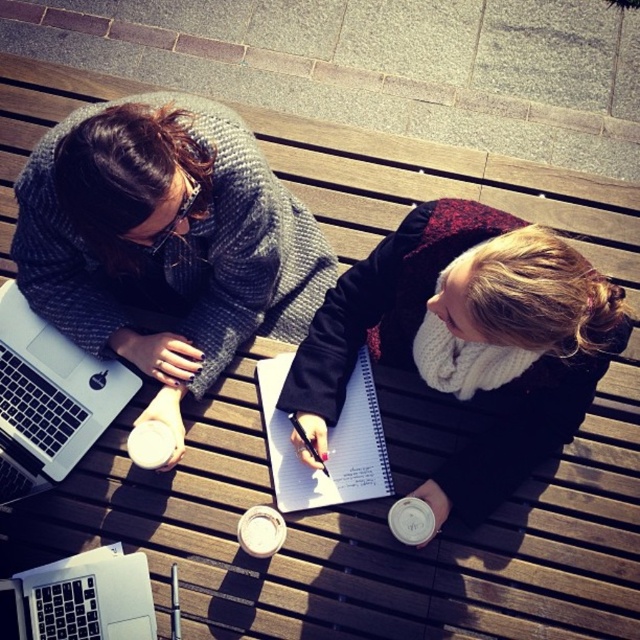
Is matte black scarf at upper left to the right of silver metallic laptop at left from the viewer's perspective?

Indeed, matte black scarf at upper left is positioned on the right side of silver metallic laptop at left.

Who is positioned more to the right, matte black scarf at upper left or silver metallic laptop at left?

matte black scarf at upper left is more to the right.

At what (x,y) coordinates should I click in order to perform the action: click on matte black scarf at upper left. Please return your answer as a coordinate pair (x, y). The width and height of the screenshot is (640, 640). Looking at the image, I should click on (164, 241).

Is the position of matte black scarf at upper left less distant than that of silver metallic laptop at lower left?

Yes, it is in front of silver metallic laptop at lower left.

The width and height of the screenshot is (640, 640). In order to click on matte black scarf at upper left in this screenshot , I will do `click(164, 241)`.

Measure the distance between point (134, 99) and camera.

Point (134, 99) and camera are 1.44 meters apart.

At what (x,y) coordinates should I click in order to perform the action: click on matte black scarf at upper left. Please return your answer as a coordinate pair (x, y). This screenshot has height=640, width=640. Looking at the image, I should click on (164, 241).

Who is more forward, (477, 481) or (316, 458)?

Point (316, 458) is more forward.

The width and height of the screenshot is (640, 640). In order to click on white knit scarf at upper right in this screenshot , I will do `click(468, 339)`.

Find the location of a particular element. This screenshot has height=640, width=640. white knit scarf at upper right is located at coordinates (468, 339).